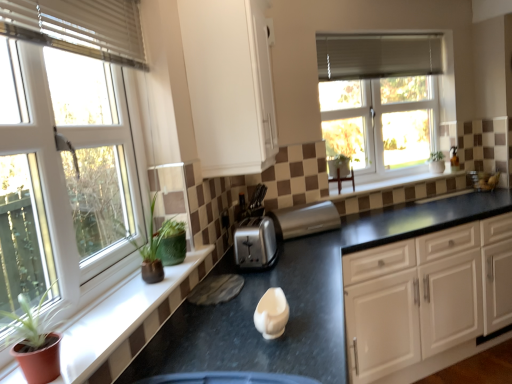
Identify the location of free spot above white fabric blind at upper right, which is counted as the 2th blind, starting from the bottom (from a real-world perspective). The width and height of the screenshot is (512, 384). (376, 36).